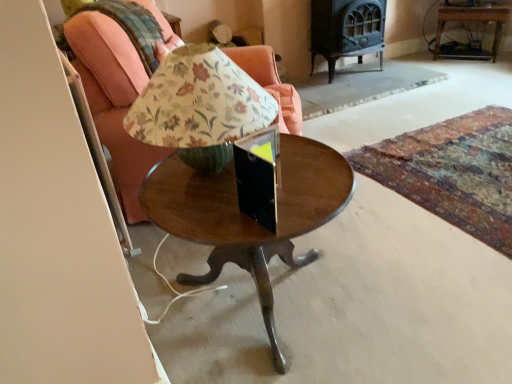
Locate an element on the screen. free space above wooden round table at center (from a real-world perspective) is located at coordinates (234, 196).